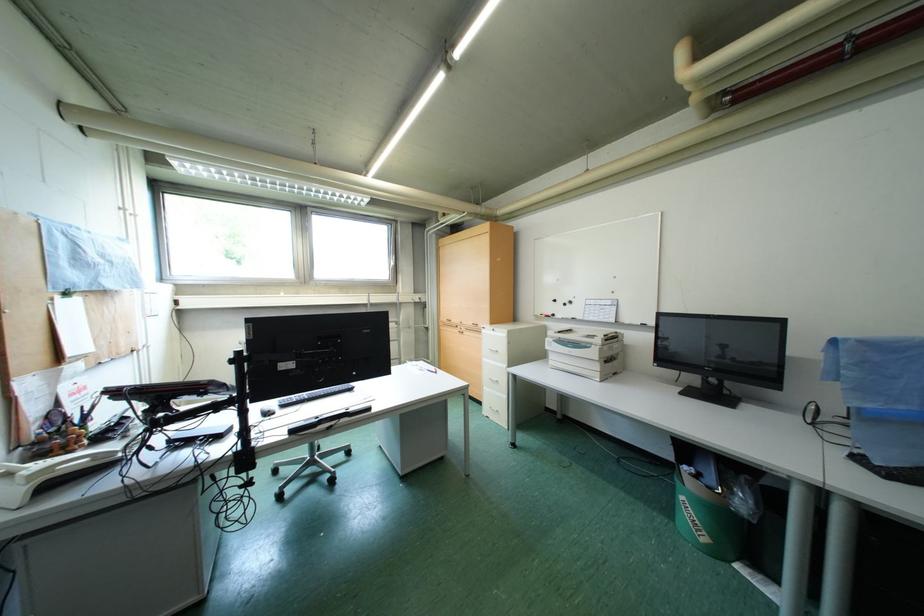
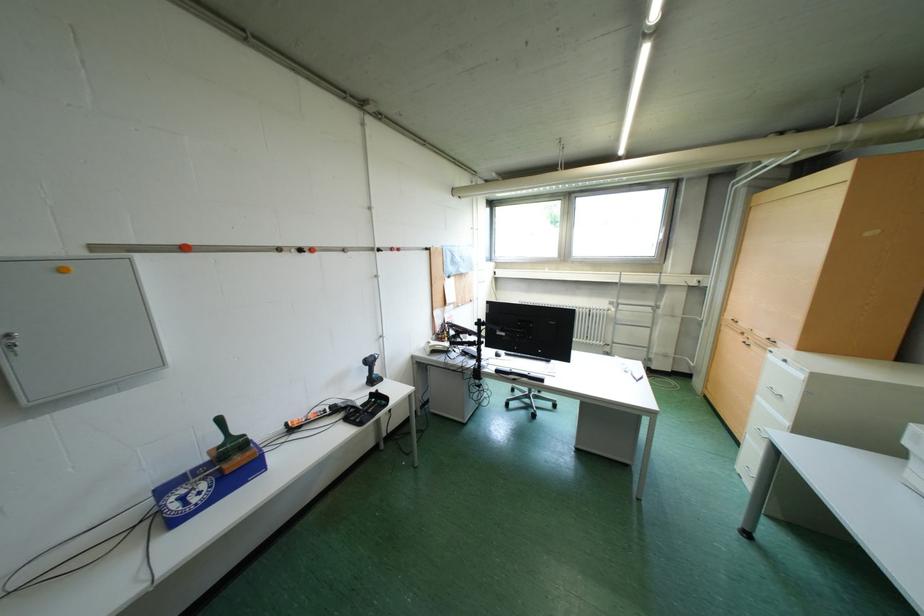
Question: The camera is either moving clockwise (left) or counter-clockwise (right) around the object. The first image is from the beginning of the video and the second image is from the end. Is the camera moving left or right when shooting the video?

Choices:
 (A) Left
 (B) Right

Answer: (B)